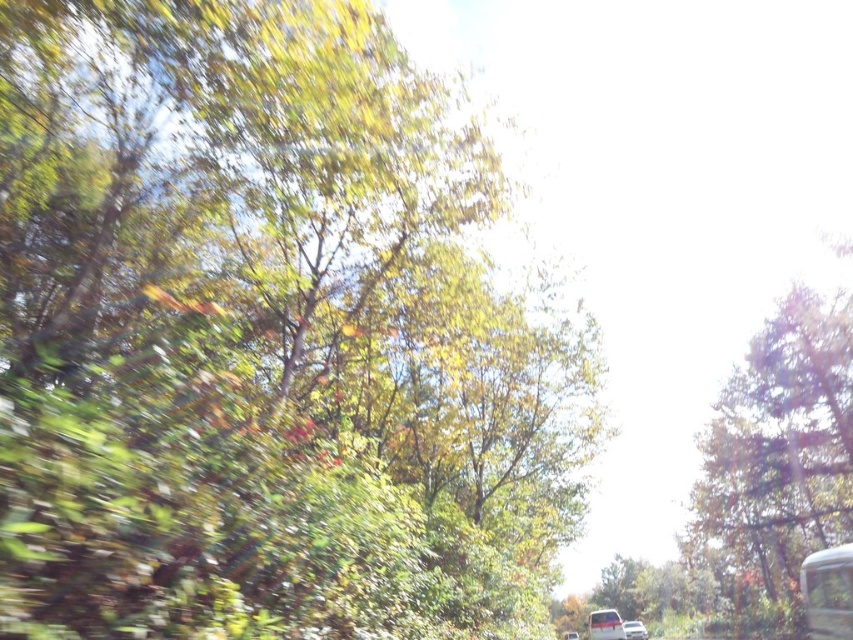
Does green leafy tree at upper left have a greater height compared to white glossy car at lower center?

Yes, green leafy tree at upper left is taller than white glossy car at lower center.

Does green leafy tree at upper left appear over white glossy car at lower center?

Yes.

Is point (329, 19) positioned in front of point (643, 627)?

Yes.

Where is `green leafy tree at upper left`? The height and width of the screenshot is (640, 853). green leafy tree at upper left is located at coordinates (262, 337).

Is green leafy tree at right positioned at the back of white glossy school bus at right?

That is True.

Looking at this image, can you confirm if green leafy tree at right is positioned above white glossy school bus at right?

Indeed, green leafy tree at right is positioned over white glossy school bus at right.

Which is behind, point (788, 506) or point (809, 605)?

The point (788, 506) is behind.

Where is `green leafy tree at right`? green leafy tree at right is located at coordinates (778, 458).

Can you confirm if green leafy tree at upper left is positioned to the left of green leafy tree at right?

Indeed, green leafy tree at upper left is positioned on the left side of green leafy tree at right.

Is point (383, 74) less distant than point (796, 474)?

Yes, point (383, 74) is closer to viewer.

Where is `green leafy tree at upper left`? green leafy tree at upper left is located at coordinates (262, 337).